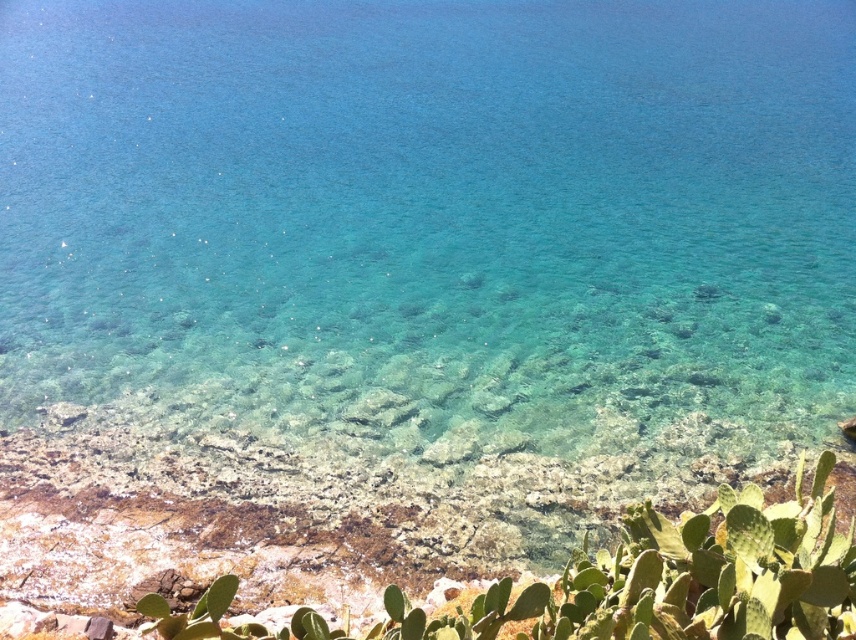
Question: Can you confirm if clear water at center is positioned below green succulent at lower right?

Choices:
 (A) yes
 (B) no

Answer: (B)

Question: Considering the relative positions of clear water at center and green succulent at lower right in the image provided, where is clear water at center located with respect to green succulent at lower right?

Choices:
 (A) left
 (B) right

Answer: (A)

Question: Which of the following is the farthest from the observer?

Choices:
 (A) clear water at center
 (B) green succulent at lower right

Answer: (A)

Question: Can you confirm if clear water at center is thinner than green succulent at lower right?

Choices:
 (A) no
 (B) yes

Answer: (A)